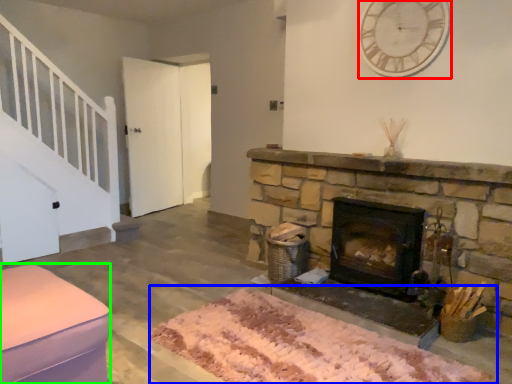
Question: Which object is the farthest from clock (highlighted by a red box)? Choose among these: mat (highlighted by a blue box) or furniture (highlighted by a green box).

Choices:
 (A) mat
 (B) furniture

Answer: (B)